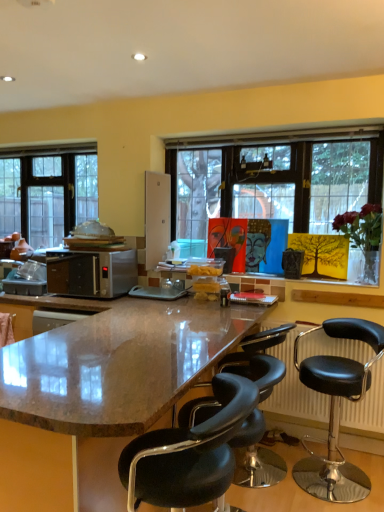
Question: Is shiny granite countertop at center oriented away from black leather stool at lower right, arranged as the second chair when viewed from the back?

Choices:
 (A) no
 (B) yes

Answer: (B)

Question: Can you confirm if shiny granite countertop at center is positioned to the left of black leather stool at lower right, arranged as the second chair when viewed from the back?

Choices:
 (A) no
 (B) yes

Answer: (B)

Question: Is shiny granite countertop at center further to camera compared to black leather stool at lower right, arranged as the second chair when viewed from the back?

Choices:
 (A) yes
 (B) no

Answer: (B)

Question: Is black leather stool at lower right, the 2th chair from the front, located within shiny granite countertop at center?

Choices:
 (A) no
 (B) yes

Answer: (A)

Question: From the image's perspective, does shiny granite countertop at center appear lower than black leather stool at lower right, arranged as the second chair when viewed from the back?

Choices:
 (A) yes
 (B) no

Answer: (A)

Question: In terms of size, does clear glass window at left appear bigger or smaller than black leather stool at lower right, the 2th chair from the front?

Choices:
 (A) big
 (B) small

Answer: (B)

Question: Does point (34, 153) appear closer or farther from the camera than point (317, 461)?

Choices:
 (A) closer
 (B) farther

Answer: (B)

Question: From the image's perspective, is clear glass window at left located above or below black leather stool at lower right, the 2th chair from the front?

Choices:
 (A) above
 (B) below

Answer: (A)

Question: In terms of height, does clear glass window at left look taller or shorter compared to black leather stool at lower right, arranged as the second chair when viewed from the back?

Choices:
 (A) tall
 (B) short

Answer: (A)

Question: Choose the correct answer: Is black leather radiator at lower right inside black leather stool at lower right, the 2th chair from the front, or outside it?

Choices:
 (A) inside
 (B) outside

Answer: (B)

Question: From their relative heights in the image, would you say black leather radiator at lower right is taller or shorter than black leather stool at lower right, the 2th chair from the front?

Choices:
 (A) tall
 (B) short

Answer: (B)

Question: Looking at the image, does black leather radiator at lower right seem bigger or smaller compared to black leather stool at lower right, the 2th chair from the front?

Choices:
 (A) small
 (B) big

Answer: (A)

Question: From the image's perspective, is black leather radiator at lower right located above or below black leather stool at lower right, arranged as the second chair when viewed from the back?

Choices:
 (A) above
 (B) below

Answer: (A)

Question: Is black leather radiator at lower right in front of or behind shiny granite countertop at center in the image?

Choices:
 (A) front
 (B) behind

Answer: (B)

Question: From the image's perspective, is black leather radiator at lower right located above or below shiny granite countertop at center?

Choices:
 (A) above
 (B) below

Answer: (A)